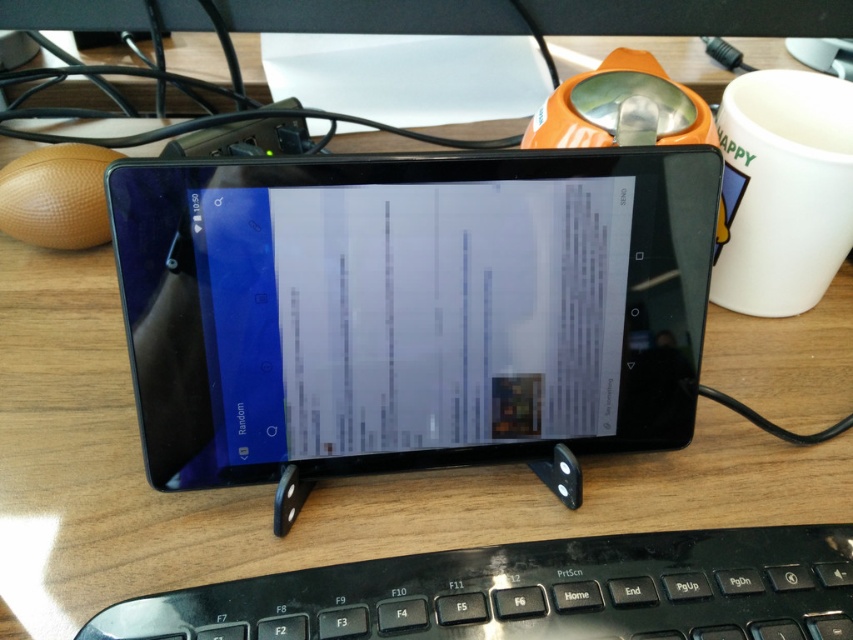
Question: Which point is closer to the camera taking this photo?

Choices:
 (A) (445, 589)
 (B) (759, 220)
 (C) (183, 294)

Answer: (A)

Question: Is black glossy tablet at center closer to camera compared to black plastic keyboard at lower center?

Choices:
 (A) no
 (B) yes

Answer: (A)

Question: Is black glossy tablet at center thinner than black plastic keyboard at lower center?

Choices:
 (A) yes
 (B) no

Answer: (A)

Question: Among these points, which one is farthest from the camera?

Choices:
 (A) (587, 352)
 (B) (383, 570)
 (C) (746, 96)

Answer: (C)

Question: Which object is the farthest from the black plastic keyboard at lower center?

Choices:
 (A) black glossy tablet at center
 (B) white ceramic mug at upper right

Answer: (B)

Question: Is black glossy tablet at center positioned in front of white ceramic mug at upper right?

Choices:
 (A) no
 (B) yes

Answer: (B)